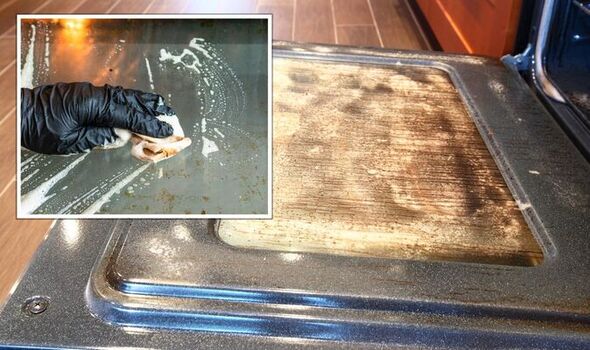
In order to click on oven window in this screenshot , I will do `click(399, 184)`.